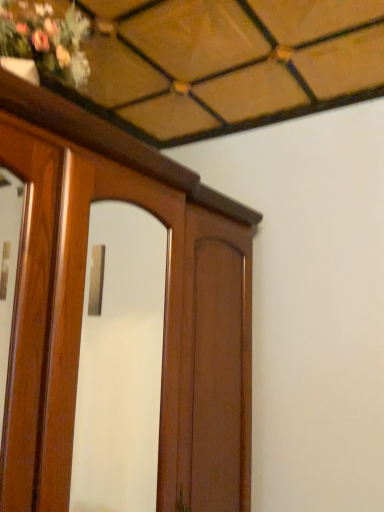
This screenshot has height=512, width=384. I want to click on shiny brown dresser at center, so click(83, 300).

Describe the element at coordinates (83, 300) in the screenshot. This screenshot has width=384, height=512. I see `shiny brown dresser at center` at that location.

The height and width of the screenshot is (512, 384). Identify the location of shiny brown dresser at center. click(83, 300).